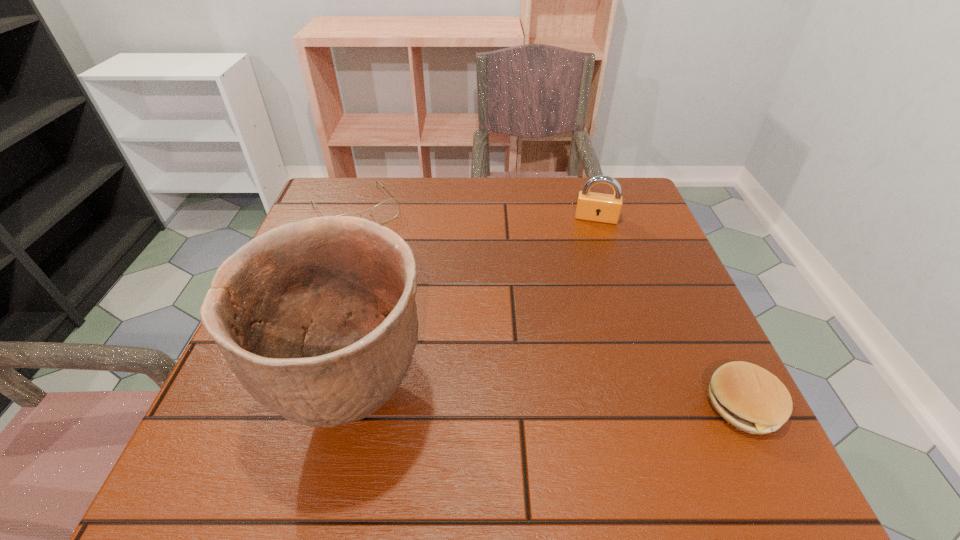
Where is `padlock at the right edge`? padlock at the right edge is located at coordinates (591, 206).

In order to click on object present at the far left corner in this screenshot , I will do `click(389, 209)`.

Identify the location of object that is at the near left corner. This screenshot has width=960, height=540. (317, 319).

Where is `object that is at the far right corner`? object that is at the far right corner is located at coordinates (591, 206).

Locate an element on the screen. This screenshot has height=540, width=960. object positioned at the near right corner is located at coordinates (750, 398).

You are a GUI agent. You are given a task and a screenshot of the screen. Output one action in this format:
    pyautogui.click(x=<x>, y=<y>)
    Task: Click on the vacant region at the far edge of the desktop
    The height and width of the screenshot is (540, 960).
    Given the screenshot: What is the action you would take?
    pyautogui.click(x=376, y=204)

The width and height of the screenshot is (960, 540). Find the location of `vacant space at the near edge of the desktop`. vacant space at the near edge of the desktop is located at coordinates (591, 418).

This screenshot has height=540, width=960. I want to click on vacant space at the right edge of the desktop, so click(x=675, y=272).

In the image, there is a desktop. Identify the location of vacant space at the far left corner. The height and width of the screenshot is (540, 960). (320, 204).

This screenshot has width=960, height=540. In the image, there is a desktop. Find the location of `vacant area at the near left corner`. vacant area at the near left corner is located at coordinates (x=215, y=408).